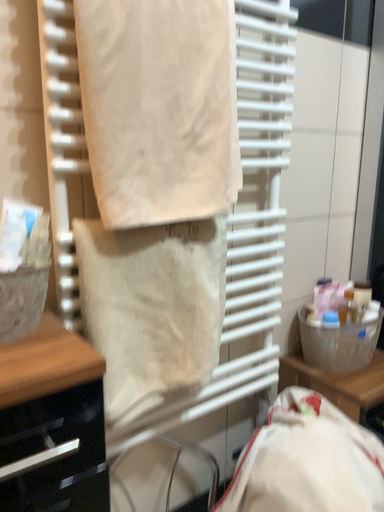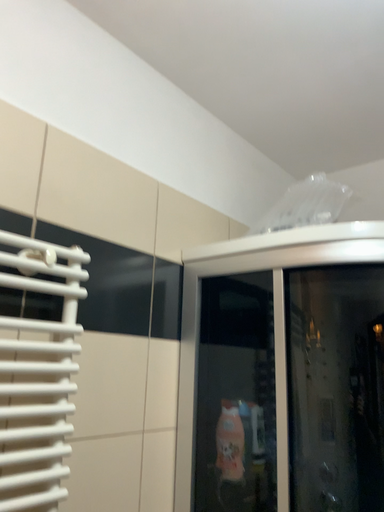
Question: Which way did the camera rotate in the video?

Choices:
 (A) rotated upward
 (B) rotated downward

Answer: (A)